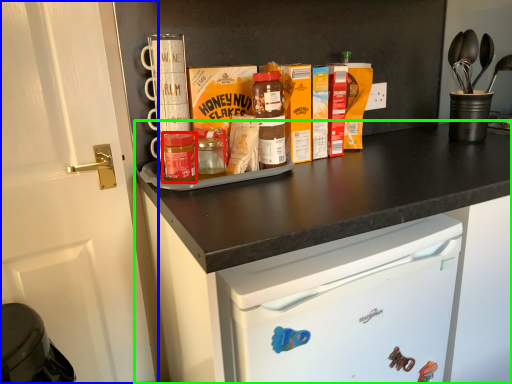
Question: Based on their relative distances, which object is nearer to bottle (highlighted by a red box)? Choose from door (highlighted by a blue box) and cabinetry (highlighted by a green box).

Choices:
 (A) door
 (B) cabinetry

Answer: (A)